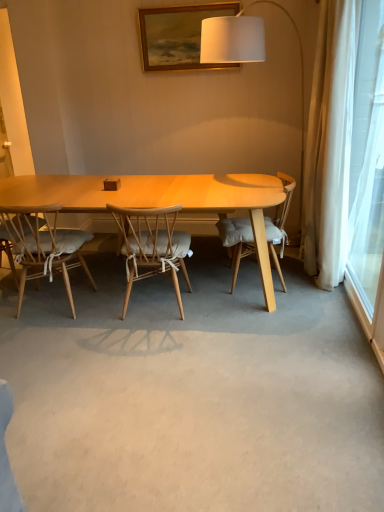
Where is `empty space that is to the right of natural wood chair with cushion at center, which is the 2th chair from right to left`? The width and height of the screenshot is (384, 512). empty space that is to the right of natural wood chair with cushion at center, which is the 2th chair from right to left is located at coordinates (223, 312).